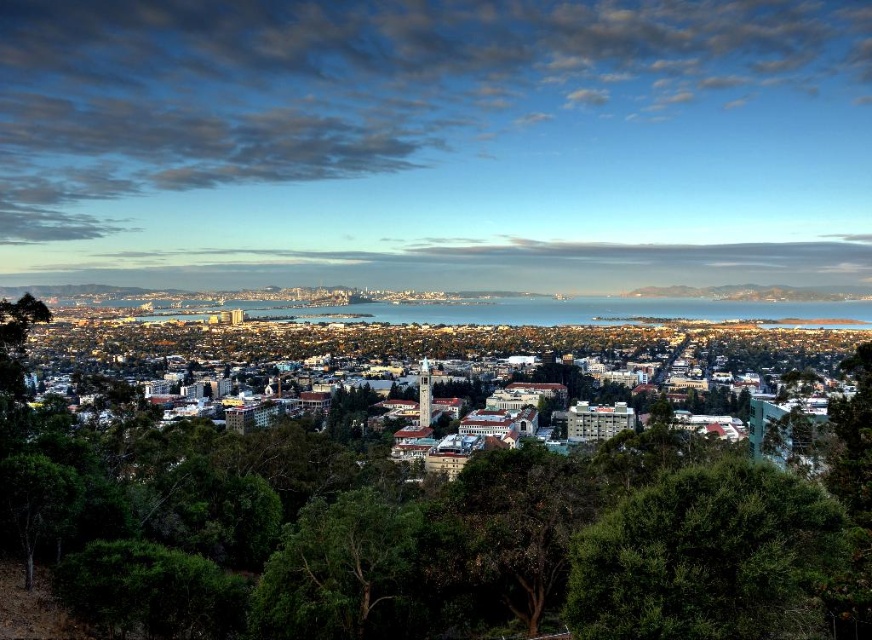
Question: Which point is closer to the camera taking this photo?

Choices:
 (A) (17, 246)
 (B) (805, 586)

Answer: (B)

Question: Can you confirm if blue sky at upper center is thinner than dark green leafy tree at lower right?

Choices:
 (A) no
 (B) yes

Answer: (A)

Question: Is blue sky at upper center thinner than dark green leafy tree at lower right?

Choices:
 (A) yes
 (B) no

Answer: (B)

Question: Does blue sky at upper center lie in front of dark green leafy tree at lower right?

Choices:
 (A) no
 (B) yes

Answer: (A)

Question: Which point is farther to the camera?

Choices:
 (A) dark green leafy tree at lower right
 (B) blue sky at upper center

Answer: (B)

Question: Which of the following is the closest to the observer?

Choices:
 (A) (637, 561)
 (B) (673, 17)

Answer: (A)